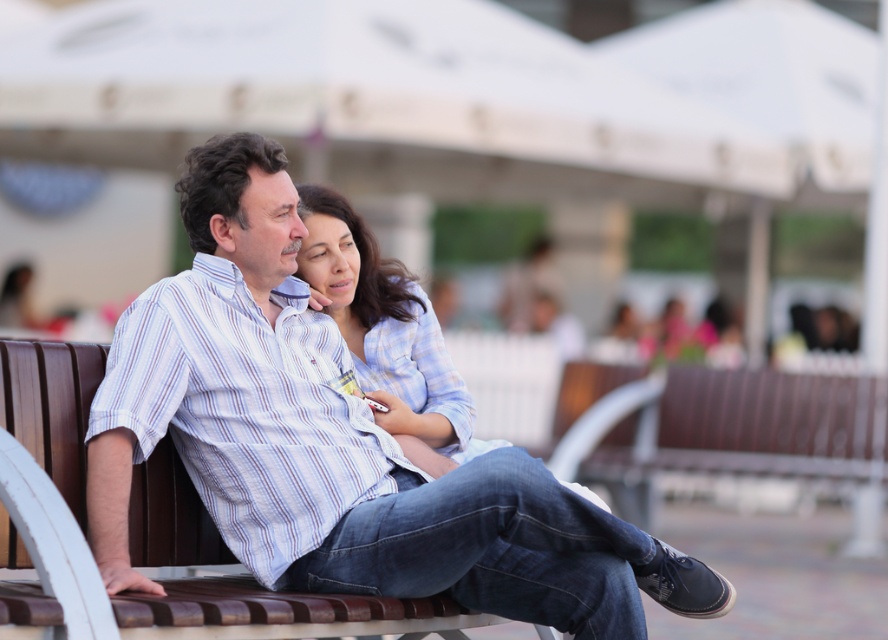
Question: Which point appears farthest from the camera in this image?

Choices:
 (A) (276, 586)
 (B) (212, 556)

Answer: (B)

Question: Among these objects, which one is nearest to the camera?

Choices:
 (A) white striped shirt at center
 (B) brown wooden bench at center
 (C) blue plaid shirt at center

Answer: (B)

Question: Does brown wooden bench at center appear on the right side of blue plaid shirt at center?

Choices:
 (A) no
 (B) yes

Answer: (A)

Question: Estimate the real-world distances between objects in this image. Which object is closer to the white striped shirt at center?

Choices:
 (A) brown wooden bench at lower right
 (B) blue plaid shirt at center

Answer: (B)

Question: Is white striped shirt at center bigger than blue plaid shirt at center?

Choices:
 (A) no
 (B) yes

Answer: (B)

Question: Does brown wooden bench at center have a larger size compared to blue plaid shirt at center?

Choices:
 (A) yes
 (B) no

Answer: (A)